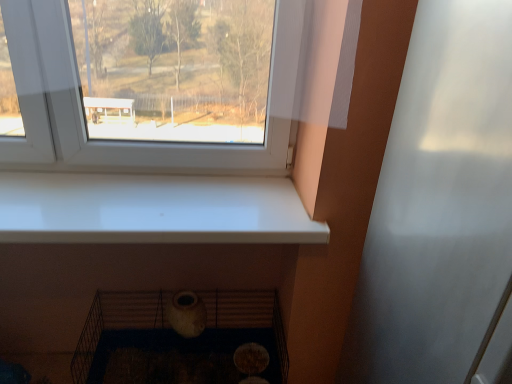
Question: In terms of width, does transparent plastic screen door at right look wider or thinner when compared to matte ceramic vase at lower center?

Choices:
 (A) wide
 (B) thin

Answer: (A)

Question: From the image's perspective, is transparent plastic screen door at right located above or below matte ceramic vase at lower center?

Choices:
 (A) below
 (B) above

Answer: (B)

Question: Relative to matte ceramic vase at lower center, is transparent plastic screen door at right in front or behind?

Choices:
 (A) front
 (B) behind

Answer: (A)

Question: In terms of height, does matte ceramic vase at lower center look taller or shorter compared to transparent plastic screen door at right?

Choices:
 (A) tall
 (B) short

Answer: (B)

Question: Is matte ceramic vase at lower center spatially inside transparent plastic screen door at right, or outside of it?

Choices:
 (A) inside
 (B) outside

Answer: (B)

Question: Looking at the image, does matte ceramic vase at lower center seem bigger or smaller compared to transparent plastic screen door at right?

Choices:
 (A) small
 (B) big

Answer: (A)

Question: From a real-world perspective, is matte ceramic vase at lower center above or below transparent plastic screen door at right?

Choices:
 (A) above
 (B) below

Answer: (B)